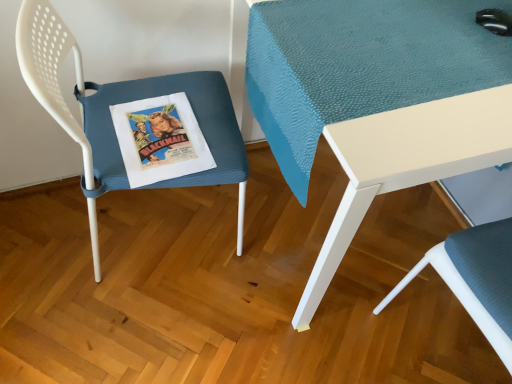
The height and width of the screenshot is (384, 512). What are the coordinates of `vacant space underneath teal fabric table at center (from a real-world perspective)` in the screenshot? It's located at (359, 238).